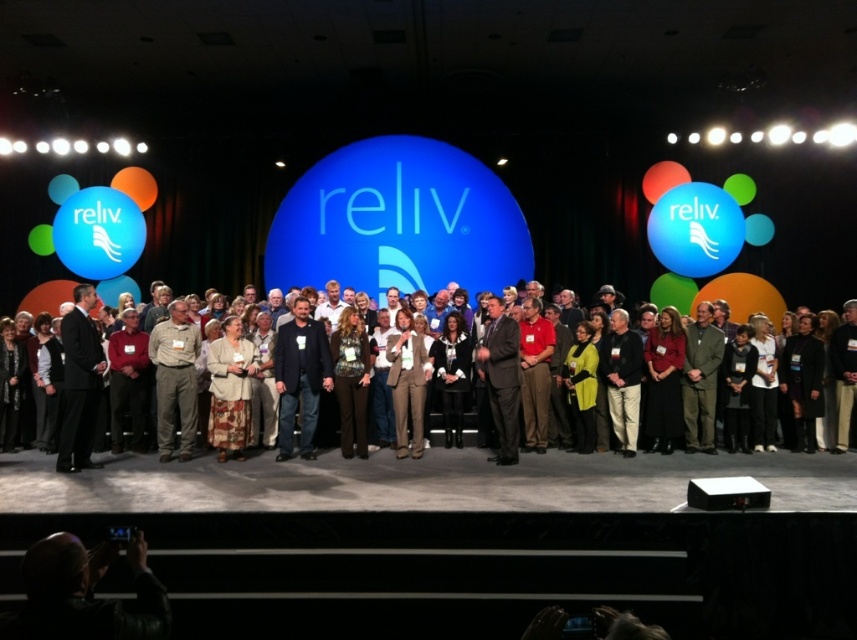
You are a photographer taking a group photo of the people on stage. You notice two individuals wearing dark blue jeans at center and khaki pants at center. Which person is standing in a position that makes their pants more visible to the audience?

The khaki pants at center is more visible to the audience because it is below the dark blue jeans at center, which is positioned above it.

From the picture: You are a photographer adjusting your camera settings to capture the group photo on stage. You notice the dark blue jeans at center and the dark brown leather jacket at center. Which item should you focus on first to ensure both are in sharp focus?

The dark blue jeans at center is closer to the viewer than the dark brown leather jacket at center, so focusing on the dark blue jeans at center first will ensure both are in sharp focus due to the depth of field.

You are a photographer standing at the back of the stage. You need to focus your camera on both the dark blue jeans at center and the khaki pants at center. Which one should you adjust the focus for first?

You should focus on the dark blue jeans at center first because it is closer to you than the khaki pants at center, which is further away.